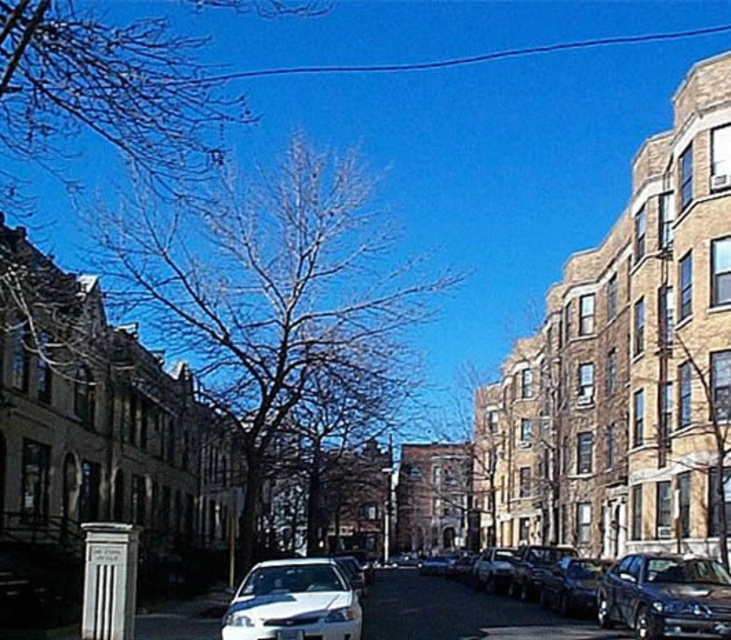
Is shiny black sedan at lower right to the left of white glossy car at center from the viewer's perspective?

In fact, shiny black sedan at lower right is to the right of white glossy car at center.

Is shiny black sedan at lower right behind white glossy car at center?

Yes, shiny black sedan at lower right is behind white glossy car at center.

At what (x,y) coordinates should I click in order to perform the action: click on shiny black sedan at lower right. Please return your answer as a coordinate pair (x, y). Image resolution: width=731 pixels, height=640 pixels. Looking at the image, I should click on (664, 596).

This screenshot has height=640, width=731. Find the location of `shiny black sedan at lower right`. shiny black sedan at lower right is located at coordinates (664, 596).

Is shiny silver sedan at center thinner than shiny black sedan at lower right?

In fact, shiny silver sedan at center might be wider than shiny black sedan at lower right.

Does point (480, 609) come closer to viewer compared to point (602, 612)?

No, it is not.

Between point (417, 593) and point (598, 620), which one is positioned in front?

Positioned in front is point (598, 620).

Locate an element on the screen. The width and height of the screenshot is (731, 640). shiny silver sedan at center is located at coordinates (462, 612).

Is the position of shiny silver sedan at center less distant than that of white glossy car at center?

No, it is not.

Who is shorter, shiny silver sedan at center or white glossy car at center?

With less height is white glossy car at center.

Measure the distance between point (522,627) and camera.

Point (522,627) and camera are 19.99 meters apart from each other.

Locate an element on the screen. shiny silver sedan at center is located at coordinates (462, 612).